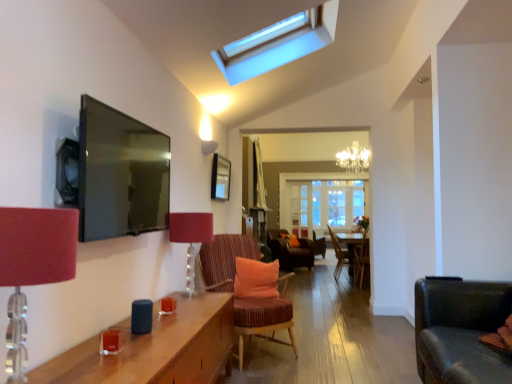
How much space does matte red lampshade at center, which is the 1th table lamp in back-to-front order, occupy vertically?

matte red lampshade at center, which is the 1th table lamp in back-to-front order, is 22.53 inches in height.

Identify the location of wooden chair at center, acting as the third chair starting from the back. Image resolution: width=512 pixels, height=384 pixels. (360, 262).

This screenshot has height=384, width=512. What do you see at coordinates (255, 278) in the screenshot? I see `orange fabric pillow at center` at bounding box center [255, 278].

The height and width of the screenshot is (384, 512). What are the coordinates of `transparent glass skylight at upper center` in the screenshot? It's located at (278, 43).

What is the approximate height of striped fabric chair with orange cushion at center, acting as the first chair starting from the front?

striped fabric chair with orange cushion at center, acting as the first chair starting from the front, is 37.20 inches tall.

The height and width of the screenshot is (384, 512). Describe the element at coordinates (339, 254) in the screenshot. I see `wooden chair at center, acting as the 2th chair starting from the back` at that location.

The height and width of the screenshot is (384, 512). Identify the location of matte red lampshade at center, the 2th table lamp viewed from the front. (190, 237).

Considering the sizes of wooden picture frame at center and striped fabric chair with orange cushion at center, marked as the fourth chair in a back-to-front arrangement, in the image, is wooden picture frame at center wider or thinner than striped fabric chair with orange cushion at center, marked as the fourth chair in a back-to-front arrangement,?

In the image, wooden picture frame at center appears to be more narrow than striped fabric chair with orange cushion at center, marked as the fourth chair in a back-to-front arrangement.

Where is `picture frame above the striped fabric chair with orange cushion at center, acting as the first chair starting from the front (from a real-world perspective)`? picture frame above the striped fabric chair with orange cushion at center, acting as the first chair starting from the front (from a real-world perspective) is located at coordinates (220, 178).

Based on the photo, which is further, [223,188] or [243,340]?

Positioned behind is point [223,188].

From a real-world perspective, is wooden picture frame at center physically below striped fabric chair with orange cushion at center, acting as the first chair starting from the front?

No, from a real-world perspective, wooden picture frame at center is not under striped fabric chair with orange cushion at center, acting as the first chair starting from the front.

Is striped fabric chair with orange cushion at center, acting as the first chair starting from the front, spatially inside matte red lampshade at left, positioned as the 1th table lamp in front-to-back order, or outside of it?

striped fabric chair with orange cushion at center, acting as the first chair starting from the front, is not enclosed by matte red lampshade at left, positioned as the 1th table lamp in front-to-back order.

What are the coordinates of `the 1st chair behind the matte red lampshade at left, positioned as the 1th table lamp in front-to-back order, counting from the anchor's position` in the screenshot? It's located at (264, 317).

Is striped fabric chair with orange cushion at center, marked as the fourth chair in a back-to-front arrangement, in contact with matte red lampshade at left, positioned as the 1th table lamp in front-to-back order?

No.

How different are the orientations of orange fabric pillow at center and wooden picture frame at center in degrees?

orange fabric pillow at center and wooden picture frame at center are facing 69.2 degrees away from each other.

Is point (245, 296) positioned in front of point (213, 156)?

Yes.

Where is `picture frame that appears above the orange fabric pillow at center (from a real-world perspective)`? picture frame that appears above the orange fabric pillow at center (from a real-world perspective) is located at coordinates [x=220, y=178].

Which of these two, orange fabric pillow at center or wooden picture frame at center, is thinner?

With smaller width is wooden picture frame at center.

Does transparent glass skylight at upper center have a greater height compared to transparent glass door at center?

No.

From a real-world perspective, is transparent glass skylight at upper center physically located above or below transparent glass door at center?

transparent glass skylight at upper center is situated higher than transparent glass door at center in the real world.

Would you say transparent glass skylight at upper center is inside or outside transparent glass door at center?

transparent glass skylight at upper center is outside transparent glass door at center.

Which of these two, transparent glass skylight at upper center or transparent glass door at center, is thinner?

Thinner between the two is transparent glass door at center.

Is wooden chair at center, acting as the third chair starting from the back, far away from velvet orange chair at center, which is the first chair in back-to-front order?

Absolutely, wooden chair at center, acting as the third chair starting from the back, is distant from velvet orange chair at center, which is the first chair in back-to-front order.

Is wooden chair at center, acting as the third chair starting from the back, taller than velvet orange chair at center, marked as the 4th chair in a front-to-back arrangement?

Correct, wooden chair at center, acting as the third chair starting from the back, is much taller as velvet orange chair at center, marked as the 4th chair in a front-to-back arrangement.

Which of these two, wooden chair at center, acting as the third chair starting from the back, or velvet orange chair at center, marked as the 4th chair in a front-to-back arrangement, is bigger?

velvet orange chair at center, marked as the 4th chair in a front-to-back arrangement.

Considering the points (333, 193) and (335, 275), which point is behind, point (333, 193) or point (335, 275)?

The point (333, 193) is more distant.

Does transparent glass door at center have a greater height compared to wooden chair at center, acting as the 2th chair starting from the back?

Correct, transparent glass door at center is much taller as wooden chair at center, acting as the 2th chair starting from the back.

From a real-world perspective, which is physically below, transparent glass door at center or wooden chair at center, which is the 3th chair in front-to-back order?

wooden chair at center, which is the 3th chair in front-to-back order, from a real-world perspective.

The height and width of the screenshot is (384, 512). In order to click on glass door to the right of wooden chair at center, acting as the 2th chair starting from the back in this screenshot , I will do `click(322, 200)`.

Considering their positions, is wooden chair at center, acting as the third chair starting from the back, located in front of or behind wooden picture frame at center?

wooden chair at center, acting as the third chair starting from the back, is behind wooden picture frame at center.

Is wooden chair at center, the second chair in the front-to-back sequence, next to wooden picture frame at center and touching it?

No, wooden chair at center, the second chair in the front-to-back sequence, is not making contact with wooden picture frame at center.

Considering the sizes of objects wooden chair at center, acting as the third chair starting from the back, and wooden picture frame at center in the image provided, who is taller, wooden chair at center, acting as the third chair starting from the back, or wooden picture frame at center?

wooden chair at center, acting as the third chair starting from the back, is taller.

Does point (362, 256) lie behind point (217, 169)?

Yes, point (362, 256) is farther from viewer.

The image size is (512, 384). In order to click on the 1st chair to the right of the wooden picture frame at center, counting from the anchor's position in this screenshot , I will do `click(264, 317)`.

Where is `the 2nd table lamp counting from the left of the striped fabric chair with orange cushion at center, acting as the first chair starting from the front`? This screenshot has width=512, height=384. the 2nd table lamp counting from the left of the striped fabric chair with orange cushion at center, acting as the first chair starting from the front is located at coordinates (32, 266).

Which object lies nearer to the anchor point transparent glass skylight at upper center, matte red lampshade at left, marked as the second table lamp in a back-to-front arrangement, or striped fabric chair with orange cushion at center, acting as the first chair starting from the front?

The object closer to transparent glass skylight at upper center is striped fabric chair with orange cushion at center, acting as the first chair starting from the front.

Considering their positions, is transparent glass skylight at upper center positioned further to wooden picture frame at center than wooden chair at center, the second chair in the front-to-back sequence?

Based on the image, wooden chair at center, the second chair in the front-to-back sequence, appears to be further to wooden picture frame at center.

When comparing their distances from wooden chair at center, acting as the third chair starting from the back, does velvet orange chair at center, marked as the 4th chair in a front-to-back arrangement, or matte red lampshade at center, the 2th table lamp viewed from the front, seem closer?

velvet orange chair at center, marked as the 4th chair in a front-to-back arrangement, lies closer to wooden chair at center, acting as the third chair starting from the back, than the other object.

Looking at this image, which object lies further to the anchor point orange fabric pillow at center, matte red lampshade at left, marked as the second table lamp in a back-to-front arrangement, or transparent glass skylight at upper center?

matte red lampshade at left, marked as the second table lamp in a back-to-front arrangement.

Consider the image. Considering their positions, is wooden picture frame at center positioned closer to wooden chair at center, acting as the third chair starting from the back, than striped fabric chair with orange cushion at center, marked as the fourth chair in a back-to-front arrangement?

wooden picture frame at center is positioned closer to the anchor wooden chair at center, acting as the third chair starting from the back.

Based on their spatial positions, is transparent glass skylight at upper center or matte red lampshade at left, positioned as the 1th table lamp in front-to-back order, closer to matte red lampshade at center, which is the 1th table lamp in back-to-front order?

The object closer to matte red lampshade at center, which is the 1th table lamp in back-to-front order, is transparent glass skylight at upper center.

From the image, which object appears to be farther from transparent glass skylight at upper center, velvet orange chair at center, which is the first chair in back-to-front order, or wooden picture frame at center?

velvet orange chair at center, which is the first chair in back-to-front order, is further to transparent glass skylight at upper center.

Estimate the real-world distances between objects in this image. Which object is closer to matte red lampshade at center, the 2th table lamp viewed from the front, wooden side table at center or wooden chair at center, which is the 3th chair in front-to-back order?

wooden side table at center.

Where is `side table located between matte red lampshade at center, the 2th table lamp viewed from the front, and velvet orange chair at center, which is the first chair in back-to-front order, in the depth direction`? The image size is (512, 384). side table located between matte red lampshade at center, the 2th table lamp viewed from the front, and velvet orange chair at center, which is the first chair in back-to-front order, in the depth direction is located at coordinates (350, 239).

You are a GUI agent. You are given a task and a screenshot of the screen. Output one action in this format:
    pyautogui.click(x=<x>, y=<y>)
    Task: Click on the side table between matte red lampshade at left, marked as the second table lamp in a back-to-front arrangement, and wooden chair at center, acting as the 2th chair starting from the back, from front to back
    Image resolution: width=512 pixels, height=384 pixels.
    Given the screenshot: What is the action you would take?
    (350, 239)

The image size is (512, 384). Identify the location of chair located between striped fabric chair with orange cushion at center, acting as the first chair starting from the front, and wooden side table at center in the depth direction. (360, 262).

This screenshot has height=384, width=512. What are the coordinates of `side table between matte red lampshade at center, the 2th table lamp viewed from the front, and transparent glass door at center, along the z-axis` in the screenshot? It's located at (350, 239).